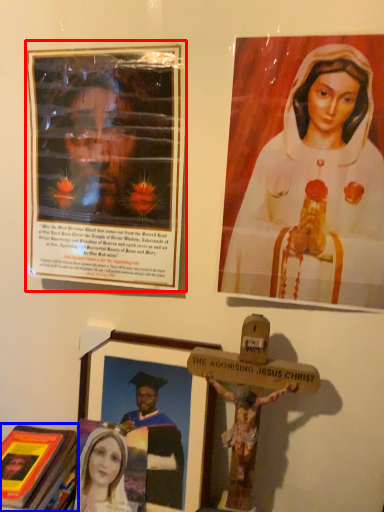
Question: Among these objects, which one is nearest to the camera, picture frame (highlighted by a red box) or book (highlighted by a blue box)?

Choices:
 (A) picture frame
 (B) book

Answer: (A)